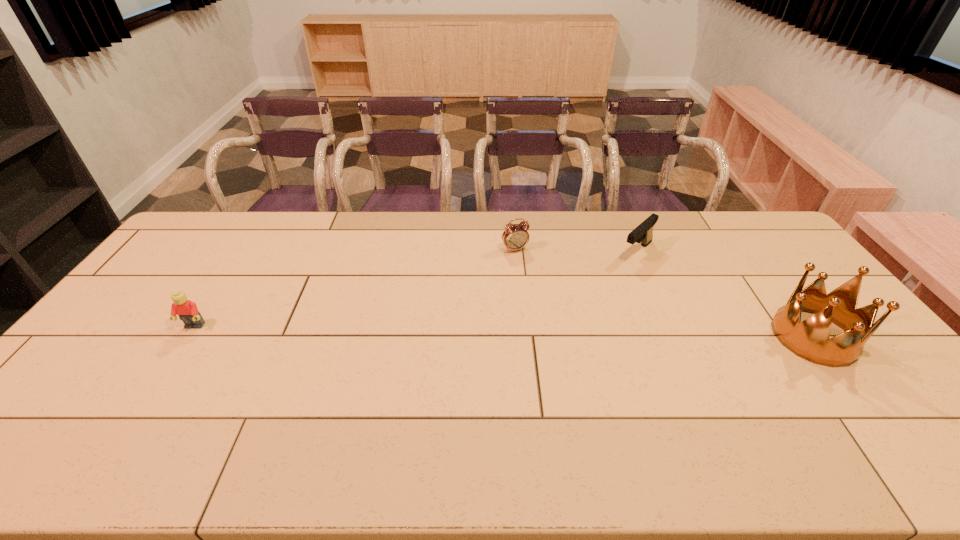
The width and height of the screenshot is (960, 540). I want to click on free region at the near left corner, so click(68, 408).

In the image, there is a desktop. Where is `vacant space at the far right corner`? The width and height of the screenshot is (960, 540). vacant space at the far right corner is located at coordinates (754, 229).

Locate an element on the screen. This screenshot has width=960, height=540. free area in between the alarm clock and the crown is located at coordinates (664, 293).

Where is `empty space between the third object from right to left and the leftmost object`? The width and height of the screenshot is (960, 540). empty space between the third object from right to left and the leftmost object is located at coordinates (354, 288).

What are the coordinates of `vacant space in between the rightmost object and the second object from left to right` in the screenshot? It's located at (664, 293).

Find the location of a particular element. This screenshot has height=540, width=960. free spot between the alarm clock and the leftmost object is located at coordinates (354, 288).

Locate an element on the screen. The image size is (960, 540). vacant space that's between the Lego and the rightmost object is located at coordinates (504, 332).

The image size is (960, 540). What are the coordinates of `empty space that is in between the Lego and the pistol` in the screenshot? It's located at (416, 289).

This screenshot has height=540, width=960. In order to click on vacant space that is in between the pistol and the Lego in this screenshot , I will do `click(416, 289)`.

Image resolution: width=960 pixels, height=540 pixels. What are the coordinates of `unoccupied area between the alarm clock and the leftmost object` in the screenshot? It's located at (354, 288).